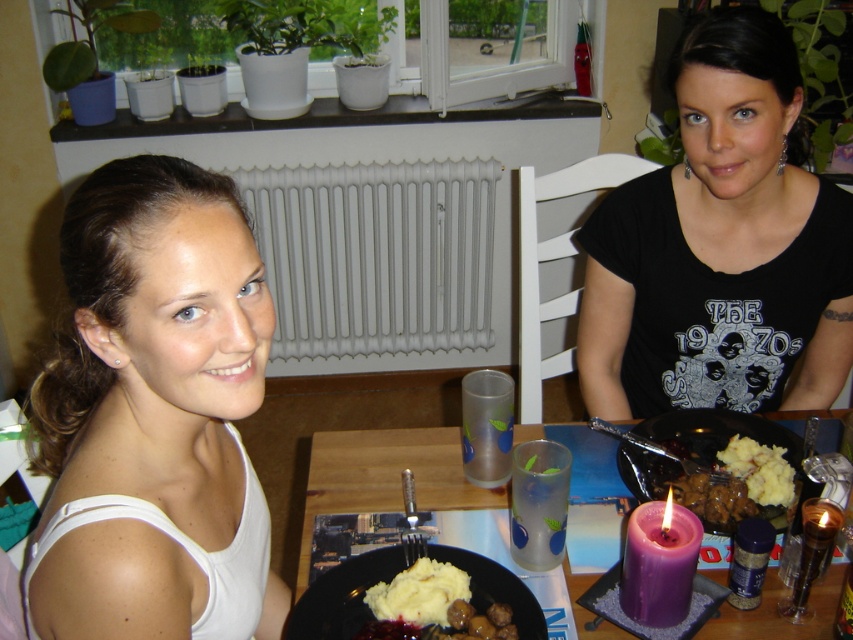
Does black matte shirt at center have a lesser height compared to white creamy mashed potatoes at center?

No, black matte shirt at center is not shorter than white creamy mashed potatoes at center.

Between black matte shirt at center and white creamy mashed potatoes at center, which one is positioned lower?

white creamy mashed potatoes at center

The width and height of the screenshot is (853, 640). I want to click on black matte shirt at center, so click(720, 246).

Does black matte shirt at center have a greater height compared to smooth creamy mashed potatoes at center?

Yes, black matte shirt at center is taller than smooth creamy mashed potatoes at center.

Does black matte shirt at center have a smaller size compared to smooth creamy mashed potatoes at center?

Incorrect, black matte shirt at center is not smaller in size than smooth creamy mashed potatoes at center.

The image size is (853, 640). What do you see at coordinates (720, 246) in the screenshot?
I see `black matte shirt at center` at bounding box center [720, 246].

Locate an element on the screen. The height and width of the screenshot is (640, 853). black matte shirt at center is located at coordinates (720, 246).

This screenshot has width=853, height=640. Describe the element at coordinates (154, 416) in the screenshot. I see `white matte tank top at upper left` at that location.

Where is `white matte tank top at upper left`? The height and width of the screenshot is (640, 853). white matte tank top at upper left is located at coordinates (154, 416).